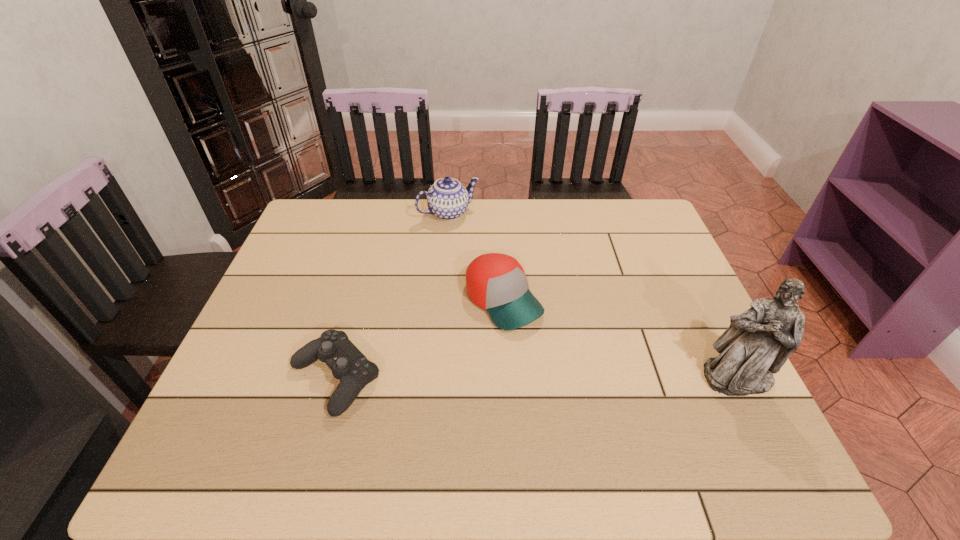
The height and width of the screenshot is (540, 960). Find the location of `the shortest object`. the shortest object is located at coordinates click(348, 364).

Locate an element on the screen. This screenshot has width=960, height=540. the leftmost object is located at coordinates (348, 364).

Where is `the tallest object`? the tallest object is located at coordinates (758, 342).

Identify the location of the rightmost object. (758, 342).

The height and width of the screenshot is (540, 960). I want to click on the third tallest object, so click(495, 282).

Identify the location of the second farthest object. (495, 282).

Locate an element on the screen. chinaware is located at coordinates (447, 198).

In order to click on the third shortest object in this screenshot , I will do `click(447, 198)`.

Locate an element on the screen. Image resolution: width=960 pixels, height=540 pixels. free space located 0.130m on the right of the leftmost object is located at coordinates pos(441,378).

Find the location of a particular element. This screenshot has height=540, width=960. vacant space located at the brim of the second farthest object is located at coordinates (553, 358).